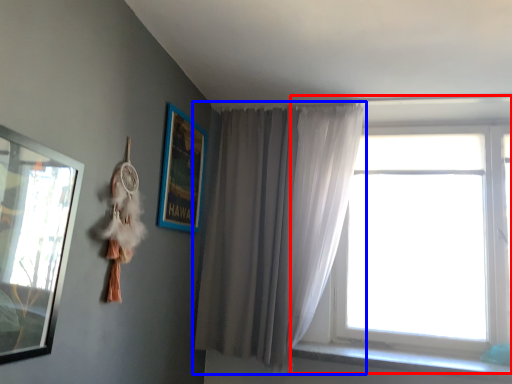
Question: Which object appears closest to the camera in this image, window (highlighted by a red box) or curtain (highlighted by a blue box)?

Choices:
 (A) window
 (B) curtain

Answer: (B)